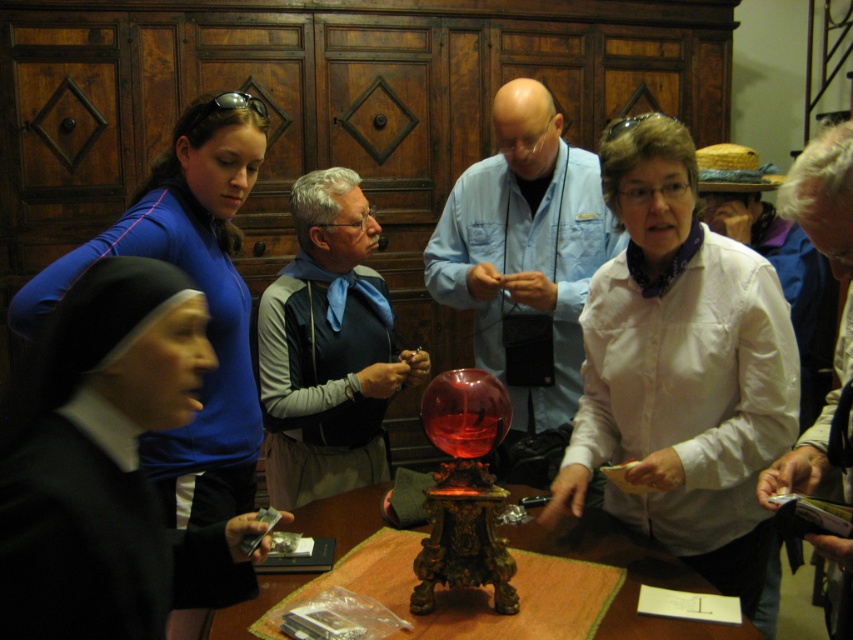
Question: Which object is positioned closest to the matte blue shirt at center?

Choices:
 (A) black nuns habit at left
 (B) white satin blouse at center
 (C) brown wooden table at center

Answer: (B)

Question: Which point appears farthest from the camera in this image?

Choices:
 (A) (825, 250)
 (B) (352, 525)
 (C) (570, 179)
 (D) (96, 308)

Answer: (C)

Question: Which object appears farthest from the camera in this image?

Choices:
 (A) matte blue shirt at center
 (B) white paper at right

Answer: (A)

Question: Does matte blue shirt at center appear under blue fabric vest at center?

Choices:
 (A) yes
 (B) no

Answer: (B)

Question: Is matte blue shirt at center positioned behind brown wooden table at center?

Choices:
 (A) no
 (B) yes

Answer: (B)

Question: Can you confirm if blue fabric vest at center is positioned to the right of white paper at right?

Choices:
 (A) yes
 (B) no

Answer: (B)